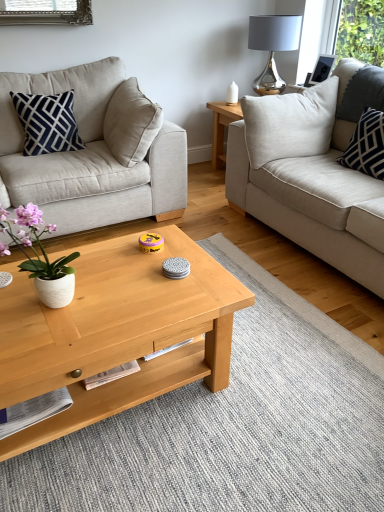
Locate an element on the screen. The width and height of the screenshot is (384, 512). free region under white ceramic pot at left (from a real-world perspective) is located at coordinates (43, 311).